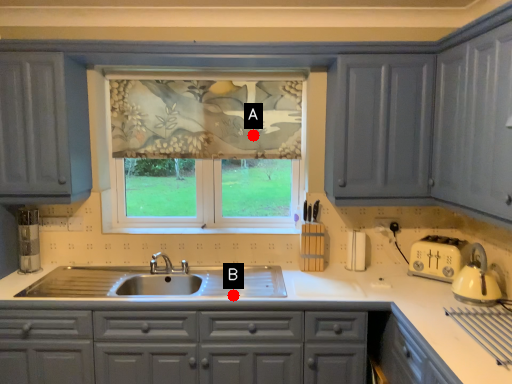
Question: Two points are circled on the image, labeled by A and B beside each circle. Which point is closer to the camera taking this photo?

Choices:
 (A) A is closer
 (B) B is closer

Answer: (B)